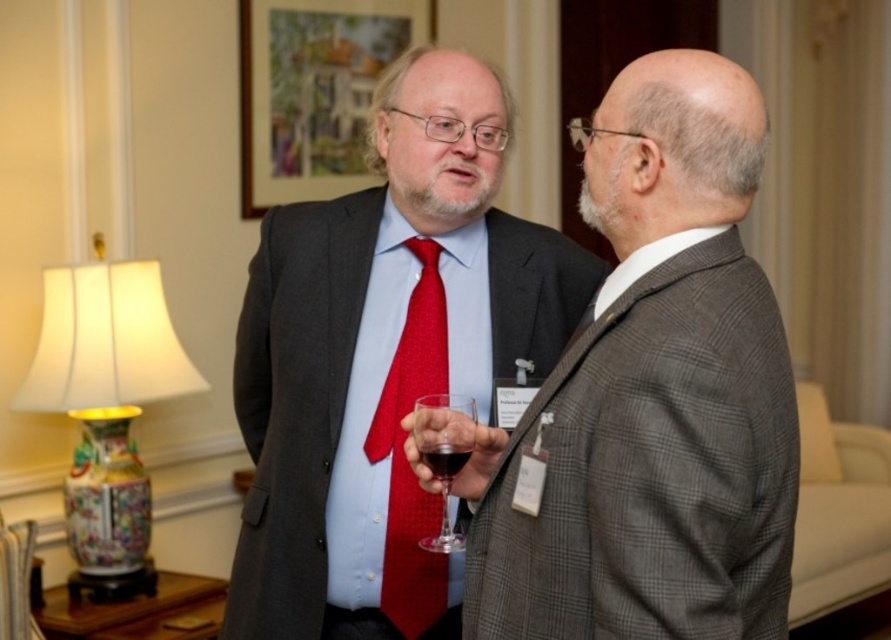
You are at a formal event and need to find the matte black suit at center. Based on the coordinates provided, which object corresponds to the location marked by point (383, 356)?

The point (383, 356) marks the location of the matte black suit at center.

You are a photographer setting up for a group photo. You need to position the matte gray suit at center and the porcelain vase at left in such a way that both are visible in the frame. Given their sizes, which object should be placed closer to the camera to ensure they appear similar in size in the photo?

The porcelain vase at left should be placed closer to the camera since the matte gray suit at center is wider. By positioning the smaller porcelain vase closer, it will appear larger in the photo, balancing the apparent size with the wider matte gray suit at center.

You are a bartender at a formal event and need to place a new drink order. You see the matte gray suit at center and the dark red liquid at center. Which object should you place the drink next to to keep it aligned with the existing setup?

The matte gray suit at center is positioned on the right side of dark red liquid at center, so to maintain alignment, place the new drink next to the dark red liquid at center on its left side.